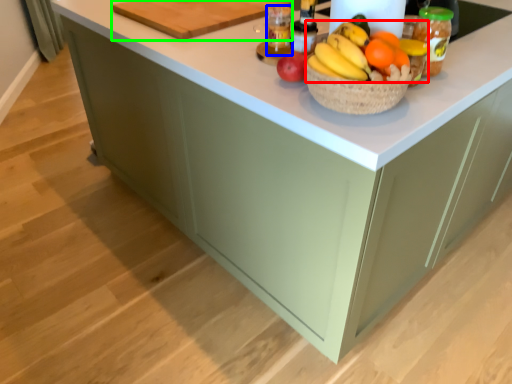
Question: Based on their relative distances, which object is farther from grapefruit (highlighted by a red box)? Choose from bottle (highlighted by a blue box) and cutting board (highlighted by a green box).

Choices:
 (A) bottle
 (B) cutting board

Answer: (B)